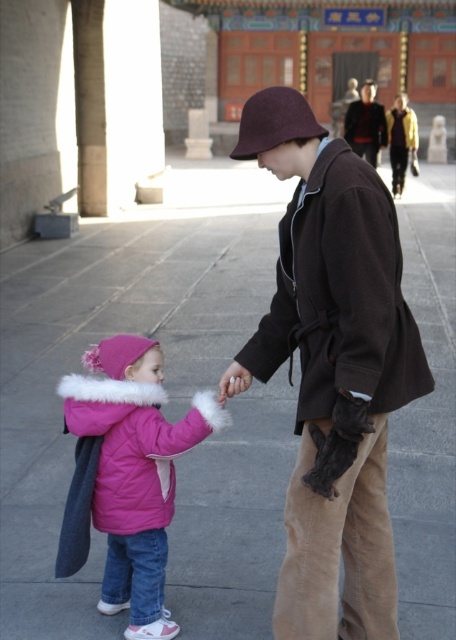
In the scene shown: Between brown woolen coat at center and smooth beige hand at center, which one appears on the right side from the viewer's perspective?

brown woolen coat at center is more to the right.

Is point (346, 420) closer to camera compared to point (234, 372)?

That is True.

Is point (346, 182) closer to viewer compared to point (242, 365)?

Yes, it is.

I want to click on brown woolen coat at center, so click(x=333, y=369).

The width and height of the screenshot is (456, 640). What do you see at coordinates (134, 470) in the screenshot? I see `matte pink puffer jacket at lower left` at bounding box center [134, 470].

Which of these two, matte pink puffer jacket at lower left or dark brown leather jacket at upper center, stands shorter?

matte pink puffer jacket at lower left is shorter.

Find the location of `matte pink puffer jacket at lower left`. matte pink puffer jacket at lower left is located at coordinates (134, 470).

This screenshot has width=456, height=640. What are the coordinates of `matte pink puffer jacket at lower left` in the screenshot? It's located at (134, 470).

Is maroon felt hat at center below smooth beige hand at center?

No, maroon felt hat at center is not below smooth beige hand at center.

The image size is (456, 640). What do you see at coordinates (274, 122) in the screenshot? I see `maroon felt hat at center` at bounding box center [274, 122].

Which is in front, point (248, 108) or point (226, 385)?

Positioned in front is point (248, 108).

The height and width of the screenshot is (640, 456). Find the location of `maroon felt hat at center`. maroon felt hat at center is located at coordinates (274, 122).